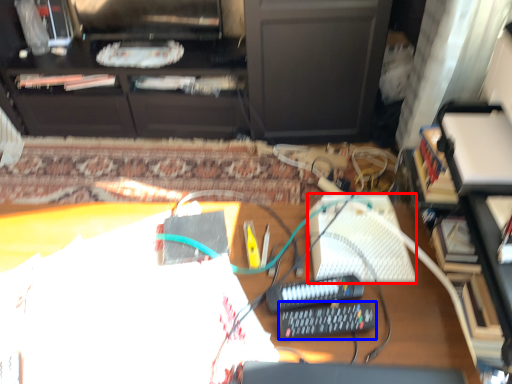
Question: Which object appears farthest to the camera in this image, keyboard (highlighted by a red box) or equipment (highlighted by a blue box)?

Choices:
 (A) keyboard
 (B) equipment

Answer: (A)